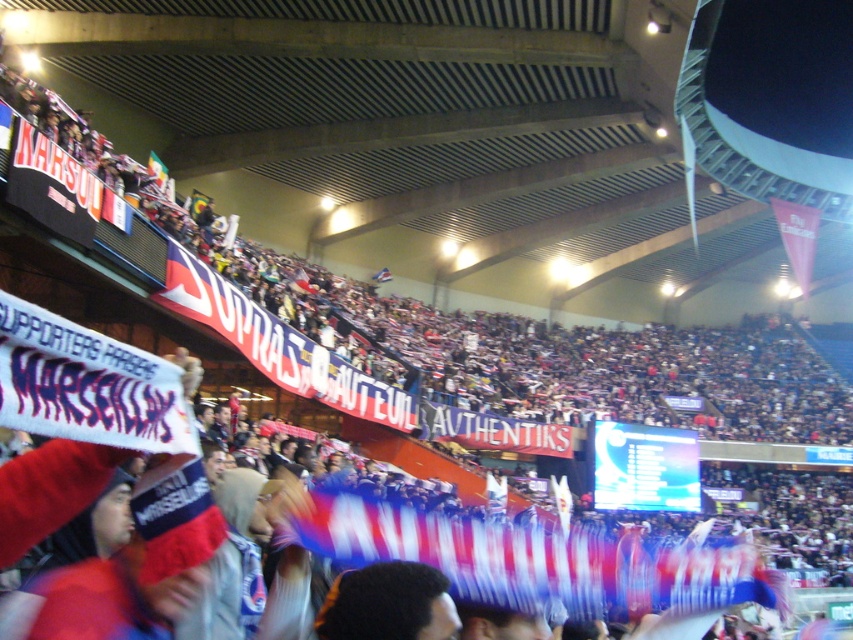
You are a photographer at the stadium trying to capture a photo of both the blue and white fabric banner at center and the blue fabric flag at center. Which one should you focus on first to ensure they are both in frame?

The blue and white fabric banner at center is positioned on the right side of blue fabric flag at center, so you should focus on the blue fabric flag at center first to ensure both are in frame.

You are a photographer at the event and want to capture the blue and white fabric banner at center. You notice a point marked at coordinates (531, 560). Based on the description, where is this point located?

The point at coordinates (531, 560) is located on the blue and white fabric banner at center.